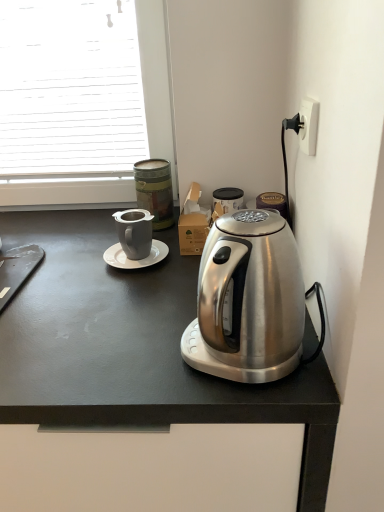
Question: Is satin silver kettle at center inside or outside of white glossy saucer at center?

Choices:
 (A) outside
 (B) inside

Answer: (A)

Question: From the image's perspective, is satin silver kettle at center located above or below white glossy saucer at center?

Choices:
 (A) above
 (B) below

Answer: (B)

Question: Which is nearer to the white plastic power outlet at upper right?

Choices:
 (A) matte gray mug at center-left
 (B) satin silver kettle at center
 (C) white glossy saucer at center
 (D) satin silver kettle at right
 (E) matte gray mug at upper center

Answer: (D)

Question: Estimate the real-world distances between objects in this image. Which object is farther from the white glossy saucer at center?

Choices:
 (A) satin silver kettle at right
 (B) white plastic power outlet at upper right
 (C) satin silver kettle at center
 (D) matte gray mug at upper center
 (E) matte gray mug at center-left

Answer: (B)